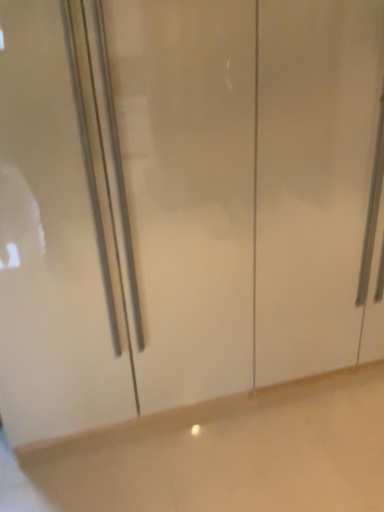
Question: Should I look upward or downward to see white glossy cabinet at center?

Choices:
 (A) up
 (B) down

Answer: (B)